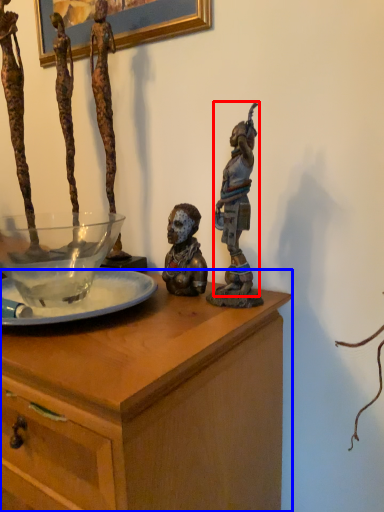
Question: Among these objects, which one is farthest to the camera, person (highlighted by a red box) or table (highlighted by a blue box)?

Choices:
 (A) person
 (B) table

Answer: (A)